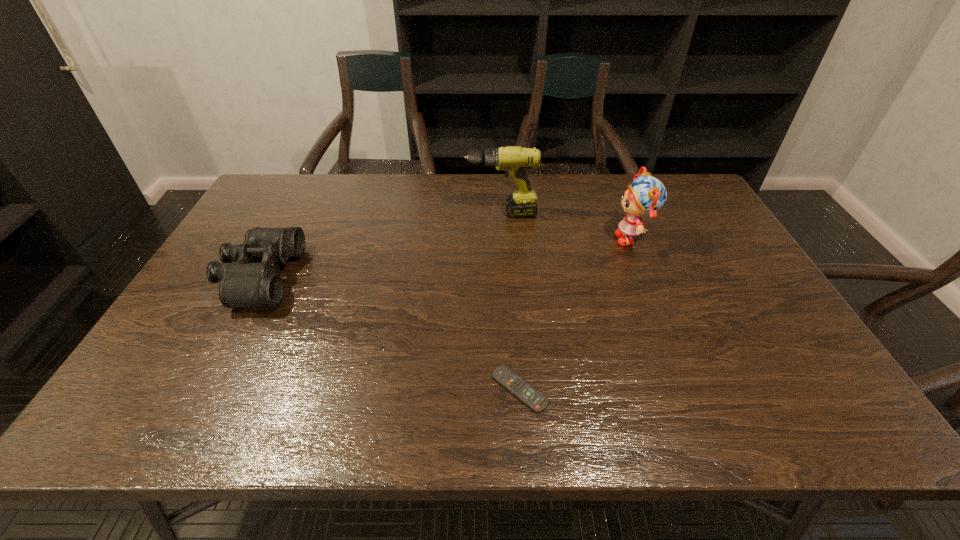
Find the location of a particular element. This screenshot has height=540, width=960. drill is located at coordinates (514, 160).

I want to click on the rightmost object, so click(x=646, y=195).

In order to click on the second shortest object in this screenshot , I will do `click(253, 279)`.

The height and width of the screenshot is (540, 960). Find the location of `binoculars`. binoculars is located at coordinates click(253, 279).

Identify the location of the nearest object. (537, 402).

The width and height of the screenshot is (960, 540). I want to click on remote control, so click(x=537, y=402).

Identify the location of vacant space situated 0.360m on the handle side of the drill. (355, 213).

Identify the location of blank space located 0.280m on the handle side of the drill. (379, 213).

Image resolution: width=960 pixels, height=540 pixels. I want to click on vacant space located on the handle side of the drill, so click(395, 213).

At what (x,y) coordinates should I click in order to perform the action: click on vacant space situated 0.080m on the face of the rightmost object. Please return your answer as a coordinate pair (x, y). This screenshot has width=960, height=540. Looking at the image, I should click on (587, 239).